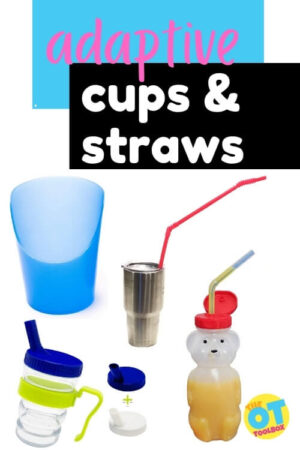
The width and height of the screenshot is (300, 450). What are the coordinates of `teddy bear cup` in the screenshot? It's located at (211, 370).